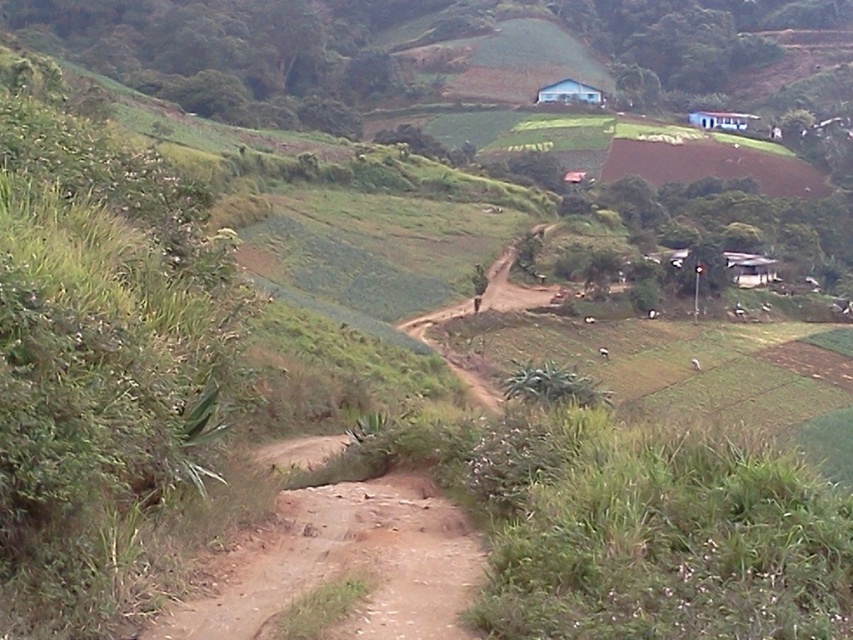
You are a hiker standing at the bottom of the hill and see the dusty brown dirt track at center and the white matte hut at upper center. Which object is higher up the hill?

The white matte hut at upper center is higher up the hill than the dusty brown dirt track at center.

You are standing at the origin point of the coordinate system in the image. You want to walk to the dusty brown dirt track at center. What direction should you head to reach it?

The dusty brown dirt track at center is located at coordinate point 0.883 on the x axis and 0.403 on the y axis. Since you are at the origin, you should move in the positive x and positive y direction to reach it.